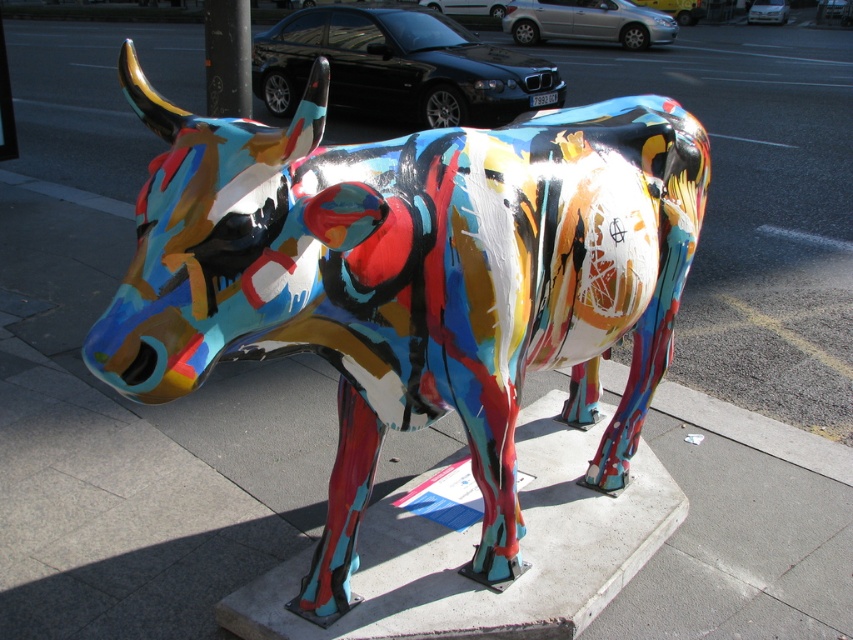
You are standing in front of the sculpture and want to take a photo. You notice two points on the sculpture marked as point 1 and point 2. If point 1 is at coordinate point (418, 308) and point 2 is at coordinate point (633, 550), which point will appear larger in your photo?

Point 1 at coordinate point (418, 308) will appear larger in the photo because it is closer to the camera than point 2 at coordinate point (633, 550).

You are a city planner assessing the placement of public art. The sculpture must not block pedestrian pathways. Given the sizes of the metallic multicolored cow at center and the black glossy pole at upper center, which object is more likely to require adjustments to ensure it does not obstruct walkways?

The metallic multicolored cow at center is larger in size than the black glossy pole at upper center, so it is more likely to require adjustments to ensure it does not obstruct walkways.

You are a photographer standing on the sidewalk. You want to take a closeup photo of the metallic multicolored cow at center. The camera you have requires you to be at least 1.5 meters away from the subject to focus properly. Can you get a clear photo?

The metallic multicolored cow at center is 1.57 meters away from the viewer. Since the minimum focusing distance required is 1.5 meters, the photographer can get a clear photo as the distance is sufficient.